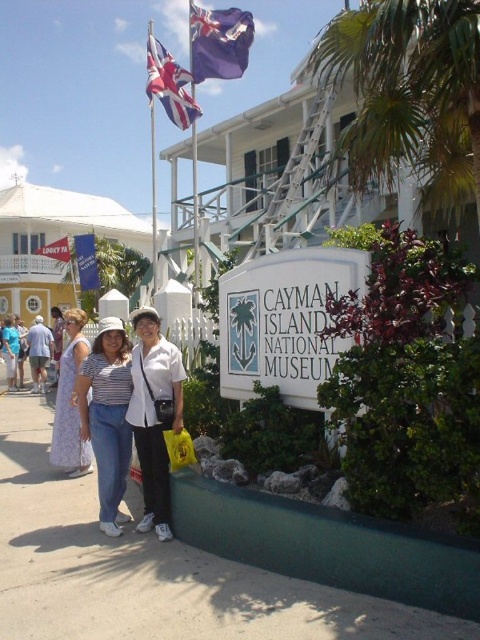
You are standing at the entrance of the Cayman Islands National Museum. You see a printed cotton dress at lower left and a blue fabric flag at upper left. Which object is closer to you?

The printed cotton dress at lower left is closer to you since it is only 29.93 feet away from the blue fabric flag at upper left, which is farther away.

You are a photographer at the Cayman Islands National Museum. You need to capture a photo that includes both the printed cotton dress at lower left and the blue fabric flag at upper left. Which object should you focus on first to ensure both are in the frame?

The printed cotton dress at lower left is closer to the viewer than the blue fabric flag at upper left, so you should focus on the printed cotton dress at lower left first to ensure both are in the frame.

Based on the photo, you are a tour guide leading a group to the Cayman Islands National Museum. You need to ensure that a new flag pole can be placed between the purple fabric flag at upper center and the union jack flag at upper left without touching either. The flag pole will be 4 feet long. Is there enough space?

The distance between the purple fabric flag at upper center and the union jack flag at upper left is 4.86 feet. Since the flag pole is 4 feet long, there is enough space to place it between them without touching either flag.